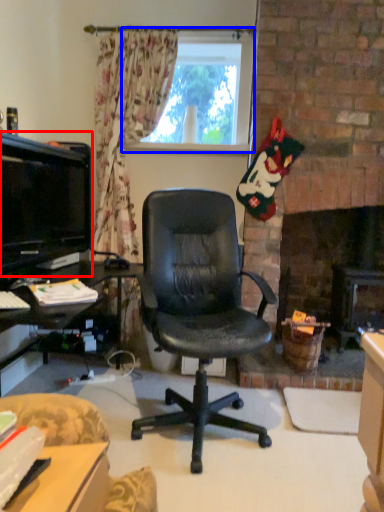
Question: Which object is closer to the camera taking this photo, television (highlighted by a red box) or window (highlighted by a blue box)?

Choices:
 (A) television
 (B) window

Answer: (A)